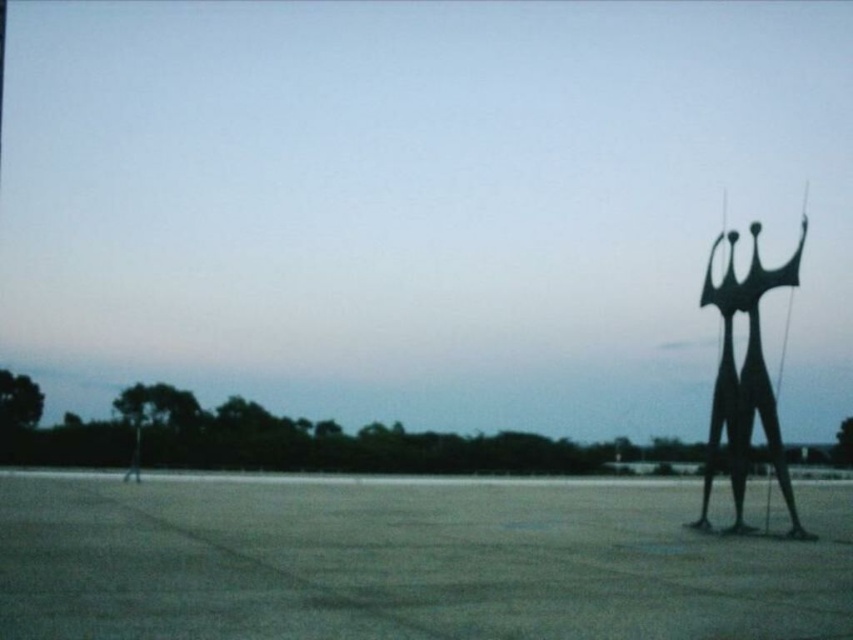
You are a delivery drone that needs to land on the smooth concrete tarmac at right. However, there is a black metal sculpture at right in the way. Can you safely land on the tarmac without hitting the sculpture?

The smooth concrete tarmac at right is taller than the black metal sculpture at right, so the drone can safely land on the tarmac without hitting the sculpture since the sculpture is lower.

You are a delivery person trying to park your van in the area shown. The van requires a space larger than the black metal sculpture at right to fit. Can you park your van on the smooth concrete tarmac at right?

The smooth concrete tarmac at right is larger in size than the black metal sculpture at right, so yes, the van can park on the smooth concrete tarmac at right since it is big enough to accommodate the vehicle.

You are standing in the plaza and want to take a photo of the sculpture. If you move forward 3 meters towards the point at coordinates point (480, 589), how far will you be from that point?

The point at coordinates point (480, 589) is initially 9.44 meters away. After moving forward 3 meters towards it, the remaining distance would be 9.44 minus 3, which equals 6.44 meters.